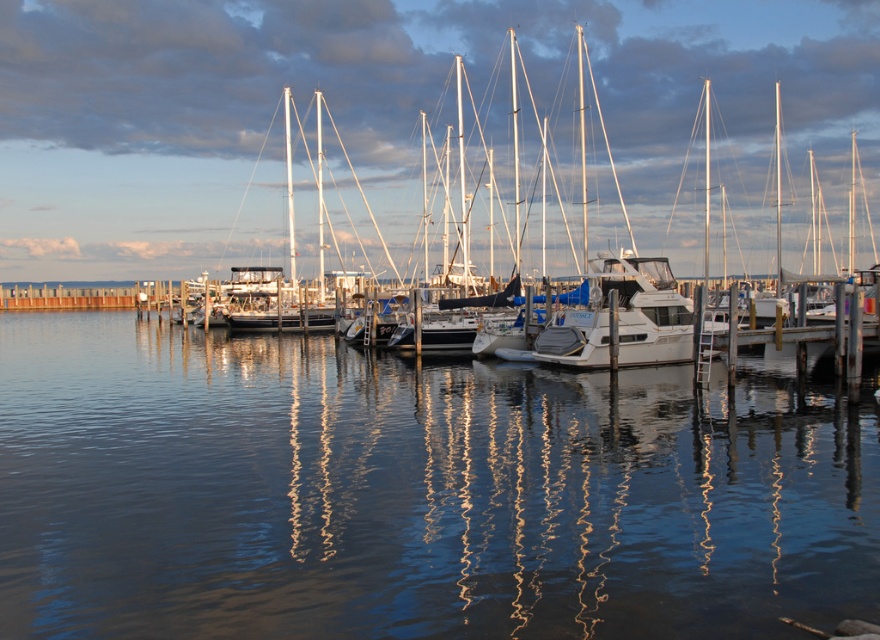
Is point (138, 609) positioned in front of point (710, 12)?

Yes.

Which is more to the right, clear water at center or white glossy sailboat at center?

Positioned to the right is clear water at center.

Is point (812, 435) farther from viewer compared to point (858, 20)?

No, (812, 435) is closer to viewer.

The height and width of the screenshot is (640, 880). What are the coordinates of `clear water at center` in the screenshot? It's located at (413, 493).

Does point (250, 104) lie in front of point (666, 269)?

No, (250, 104) is further to viewer.

Is point (812, 252) in front of point (638, 259)?

That is False.

I want to click on white glossy sailboat at center, so click(463, 131).

Does clear water at center have a greater width compared to white glossy boat at center?

Yes.

Which is more to the right, clear water at center or white glossy boat at center?

From the viewer's perspective, white glossy boat at center appears more on the right side.

The image size is (880, 640). Identify the location of clear water at center. (413, 493).